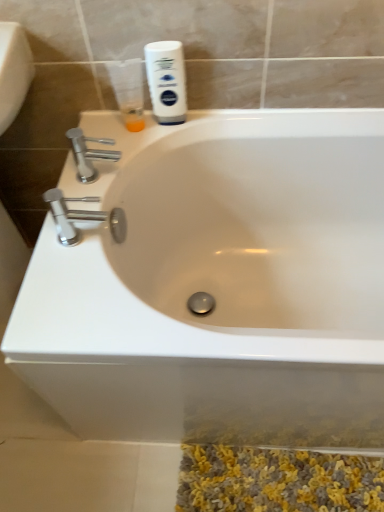
Locate an element on the screen. This screenshot has width=384, height=512. vacant area that lies to the right of translucent plastic cup at upper left is located at coordinates (198, 124).